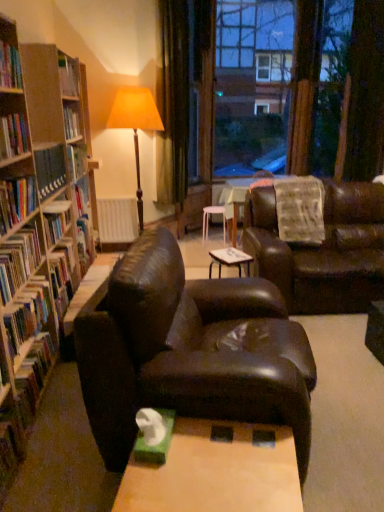
The height and width of the screenshot is (512, 384). Identify the location of free point in front of green matte tissue box at lower center. (161, 480).